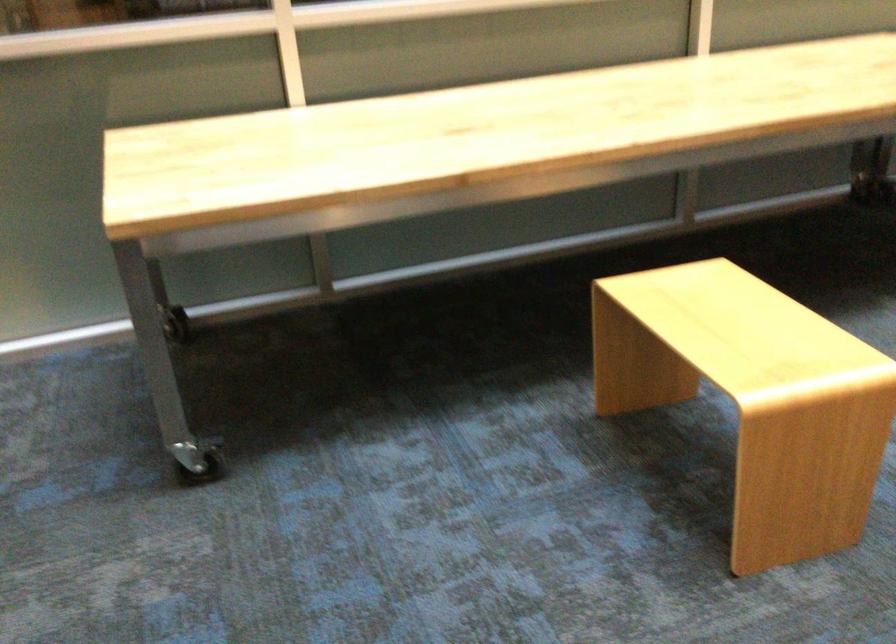
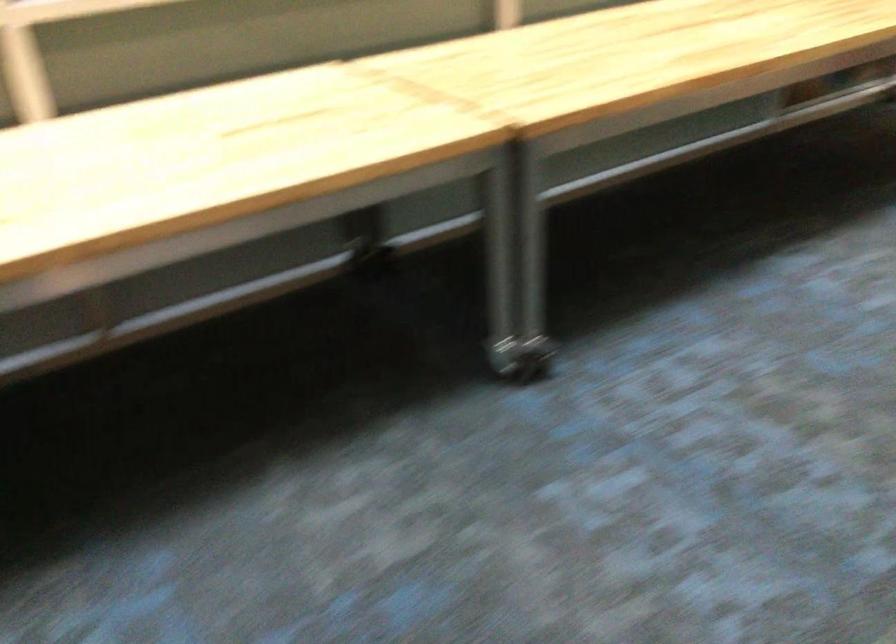
What movement of the cameraman would produce the second image?

The cameraman walked toward right, forward.